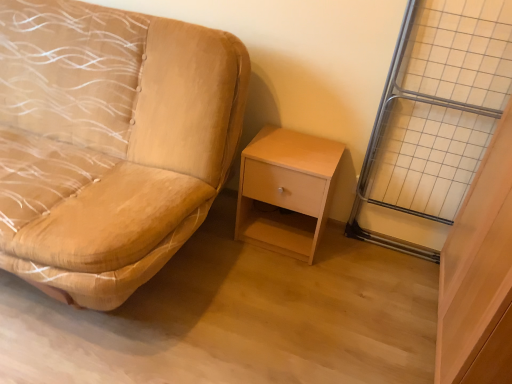
You are a GUI agent. You are given a task and a screenshot of the screen. Output one action in this format:
    pyautogui.click(x=<x>, y=<y>)
    Task: Click on the light wood/finely finished nightstand at center-right
    This screenshot has width=512, height=384.
    Given the screenshot: What is the action you would take?
    pyautogui.click(x=286, y=190)

What do you see at coordinates (436, 112) in the screenshot?
I see `metal grid at right` at bounding box center [436, 112].

I want to click on suede-like beige studio couch at left, so 109,142.

Is suede-like beige studio couch at left wider than light wood/finely finished nightstand at center-right?

Correct, the width of suede-like beige studio couch at left exceeds that of light wood/finely finished nightstand at center-right.

Who is smaller, suede-like beige studio couch at left or light wood/finely finished nightstand at center-right?

Smaller between the two is light wood/finely finished nightstand at center-right.

Which object is positioned more to the right, suede-like beige studio couch at left or light wood/finely finished nightstand at center-right?

From the viewer's perspective, light wood/finely finished nightstand at center-right appears more on the right side.

From the image's perspective, is suede-like beige studio couch at left above or below light wood/finely finished nightstand at center-right?

suede-like beige studio couch at left is situated higher than light wood/finely finished nightstand at center-right in the image.

From their relative heights in the image, would you say suede-like beige studio couch at left is taller or shorter than metal grid at right?

suede-like beige studio couch at left is shorter than metal grid at right.

Is point (151, 255) closer to viewer compared to point (382, 196)?

Yes.

This screenshot has height=384, width=512. I want to click on glass door above the suede-like beige studio couch at left (from a real-world perspective), so click(x=436, y=112).

Is suede-like beige studio couch at left oriented towards metal grid at right?

No, suede-like beige studio couch at left is not aimed at metal grid at right.

Looking at their sizes, would you say light wood/finely finished nightstand at center-right is wider or thinner than suede-like beige studio couch at left?

Clearly, light wood/finely finished nightstand at center-right has less width compared to suede-like beige studio couch at left.

Choose the correct answer: Is light wood/finely finished nightstand at center-right inside suede-like beige studio couch at left or outside it?

light wood/finely finished nightstand at center-right is not enclosed by suede-like beige studio couch at left.

Who is smaller, light wood/finely finished nightstand at center-right or suede-like beige studio couch at left?

Smaller between the two is light wood/finely finished nightstand at center-right.

Considering the positions of objects light wood/finely finished nightstand at center-right and metal grid at right in the image provided, who is more to the right, light wood/finely finished nightstand at center-right or metal grid at right?

From the viewer's perspective, metal grid at right appears more on the right side.

The height and width of the screenshot is (384, 512). Identify the location of nightstand on the left side of metal grid at right. tap(286, 190).

Is light wood/finely finished nightstand at center-right inside the boundaries of metal grid at right, or outside?

The correct answer is: outside.

Considering the sizes of metal grid at right and suede-like beige studio couch at left in the image, is metal grid at right bigger or smaller than suede-like beige studio couch at left?

In the image, metal grid at right appears to be smaller than suede-like beige studio couch at left.

Considering the sizes of metal grid at right and suede-like beige studio couch at left in the image, is metal grid at right taller or shorter than suede-like beige studio couch at left?

Clearly, metal grid at right is taller compared to suede-like beige studio couch at left.

Is metal grid at right positioned beyond the bounds of suede-like beige studio couch at left?

metal grid at right is positioned outside suede-like beige studio couch at left.

From the image's perspective, is metal grid at right positioned above or below suede-like beige studio couch at left?

From the image's perspective, metal grid at right appears below suede-like beige studio couch at left.

Considering the relative sizes of metal grid at right and light wood/finely finished nightstand at center-right in the image provided, is metal grid at right thinner than light wood/finely finished nightstand at center-right?

Indeed, metal grid at right has a lesser width compared to light wood/finely finished nightstand at center-right.

From a real-world perspective, does metal grid at right sit lower than light wood/finely finished nightstand at center-right?

Incorrect, from a real-world perspective, metal grid at right is higher than light wood/finely finished nightstand at center-right.

Find the location of a particular element. Image resolution: width=512 pixels, height=384 pixels. nightstand lying on the left of metal grid at right is located at coordinates [286, 190].

Find the location of a particular element. This screenshot has width=512, height=384. nightstand located underneath the suede-like beige studio couch at left (from a real-world perspective) is located at coordinates (286, 190).

Identify the location of studio couch lying above the metal grid at right (from the image's perspective). (109, 142).

Based on their spatial positions, is light wood/finely finished nightstand at center-right or suede-like beige studio couch at left further from metal grid at right?

suede-like beige studio couch at left is further to metal grid at right.

Consider the image. Based on their spatial positions, is suede-like beige studio couch at left or metal grid at right further from light wood/finely finished nightstand at center-right?

suede-like beige studio couch at left is positioned further to the anchor light wood/finely finished nightstand at center-right.

From the picture: Based on their spatial positions, is metal grid at right or light wood/finely finished nightstand at center-right closer to suede-like beige studio couch at left?

light wood/finely finished nightstand at center-right.

Looking at the image, which one is located further to light wood/finely finished nightstand at center-right, metal grid at right or suede-like beige studio couch at left?

The object further to light wood/finely finished nightstand at center-right is suede-like beige studio couch at left.

Estimate the real-world distances between objects in this image. Which object is further from metal grid at right, suede-like beige studio couch at left or light wood/finely finished nightstand at center-right?

Among the two, suede-like beige studio couch at left is located further to metal grid at right.

Which object lies nearer to the anchor point suede-like beige studio couch at left, light wood/finely finished nightstand at center-right or metal grid at right?

light wood/finely finished nightstand at center-right lies closer to suede-like beige studio couch at left than the other object.

You are a GUI agent. You are given a task and a screenshot of the screen. Output one action in this format:
    pyautogui.click(x=<x>, y=<y>)
    Task: Click on the nightstand situated between suede-like beige studio couch at left and metal grid at right from left to right
    Image resolution: width=512 pixels, height=384 pixels.
    Given the screenshot: What is the action you would take?
    pyautogui.click(x=286, y=190)